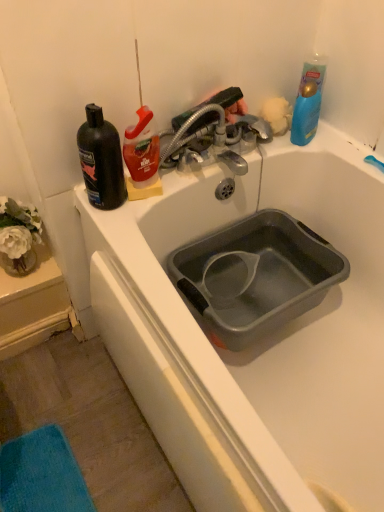
Question: Is the position of black matte bottle at left more distant than that of fluffy yellow sponge at upper right?

Choices:
 (A) yes
 (B) no

Answer: (B)

Question: Is black matte bottle at left surrounding fluffy yellow sponge at upper right?

Choices:
 (A) no
 (B) yes

Answer: (A)

Question: Can you confirm if black matte bottle at left is thinner than fluffy yellow sponge at upper right?

Choices:
 (A) yes
 (B) no

Answer: (B)

Question: From the image's perspective, is black matte bottle at left on top of fluffy yellow sponge at upper right?

Choices:
 (A) no
 (B) yes

Answer: (A)

Question: Does black matte bottle at left have a smaller size compared to fluffy yellow sponge at upper right?

Choices:
 (A) yes
 (B) no

Answer: (B)

Question: Can you confirm if black matte bottle at left is bigger than fluffy yellow sponge at upper right?

Choices:
 (A) yes
 (B) no

Answer: (A)

Question: Is metallic silver faucet at upper center taller than blue glossy bottle at upper right?

Choices:
 (A) no
 (B) yes

Answer: (A)

Question: From the image's perspective, is metallic silver faucet at upper center under blue glossy bottle at upper right?

Choices:
 (A) no
 (B) yes

Answer: (B)

Question: Is metallic silver faucet at upper center shorter than blue glossy bottle at upper right?

Choices:
 (A) yes
 (B) no

Answer: (A)

Question: Can you confirm if metallic silver faucet at upper center is bigger than blue glossy bottle at upper right?

Choices:
 (A) yes
 (B) no

Answer: (A)

Question: Can you confirm if metallic silver faucet at upper center is smaller than blue glossy bottle at upper right?

Choices:
 (A) no
 (B) yes

Answer: (A)

Question: Is metallic silver faucet at upper center positioned beyond the bounds of blue glossy bottle at upper right?

Choices:
 (A) no
 (B) yes

Answer: (B)

Question: Is metallic silver faucet at upper center behind fluffy yellow sponge at upper right?

Choices:
 (A) no
 (B) yes

Answer: (A)